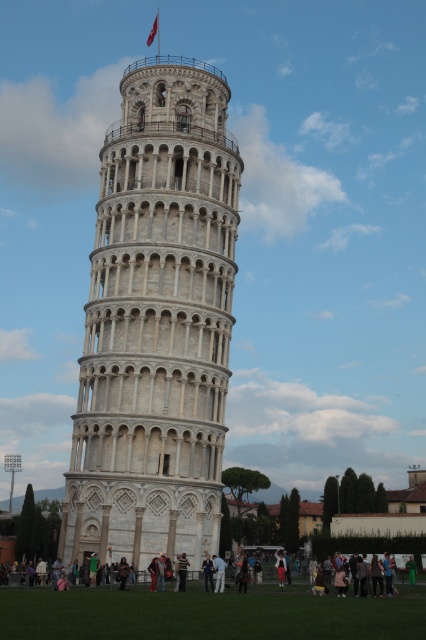
Who is more distant from viewer, (109, 577) or (183, 556)?

Point (109, 577)

Between light brown wooden bench at lower center and striped sweater at center, which one appears on the left side from the viewer's perspective?

striped sweater at center is more to the left.

Between point (190, 573) and point (181, 557), which one is positioned behind?

Positioned behind is point (190, 573).

In order to click on light brown wooden bench at lower center in this screenshot , I will do `click(405, 572)`.

Does white stone tower at center have a larger size compared to light brown wooden bench at lower center?

Yes.

Does white stone tower at center come behind light brown wooden bench at lower center?

No, it is in front of light brown wooden bench at lower center.

Does point (173, 209) come behind point (327, 582)?

No, it is not.

Locate an element on the screen. Image resolution: width=426 pixels, height=640 pixels. white stone tower at center is located at coordinates (157, 323).

Between white stone tower at center and striped sweater at center, which one has more height?

white stone tower at center

In the scene shown: Which is more to the left, white stone tower at center or striped sweater at center?

white stone tower at center

Where is `white stone tower at center`? white stone tower at center is located at coordinates (157, 323).